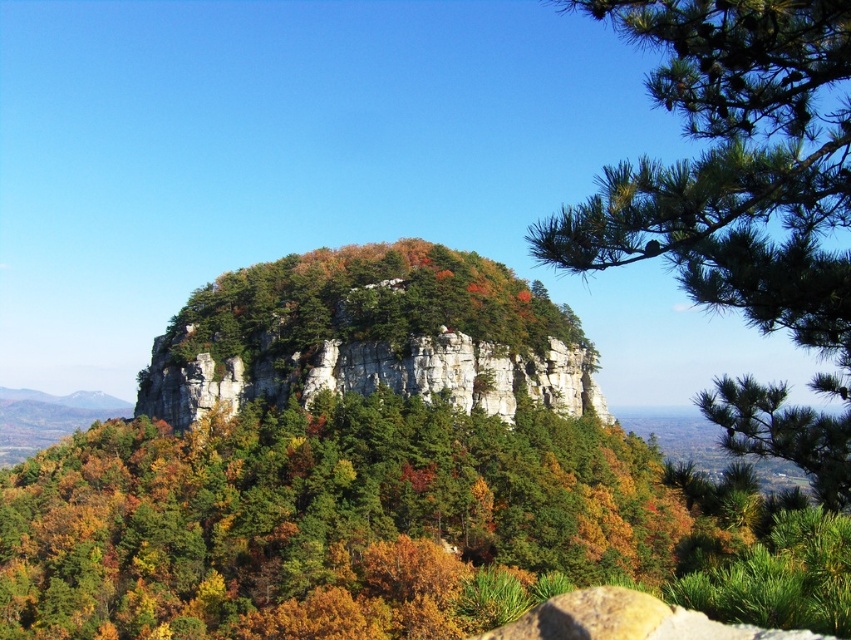
You are an environmental scientist assessing the landscape. You need to determine which object is taller between the green matte tree at center and the rocky cliff at center. Based on the scene, which one is taller?

The rocky cliff at center is taller than the green matte tree at center.

You are a hiker standing at the base of the rocky cliff at center and want to reach the green matte tree at center. Which direction should you move to get there?

The green matte tree at center is positioned on the right side of the rocky cliff at center, so you should move to the right to reach it.